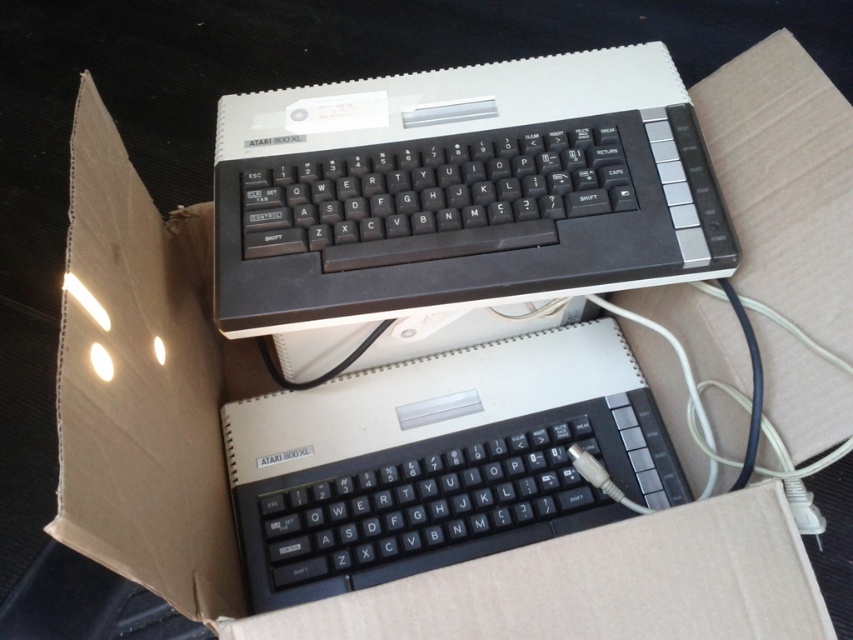
Who is positioned more to the right, black plastic keyboard at upper center or black plastic keyboard at center?

black plastic keyboard at upper center is more to the right.

Does point (573, 147) come behind point (439, 525)?

No, (573, 147) is in front of (439, 525).

Who is more distant from viewer, (399, 211) or (546, 380)?

Point (546, 380)

Find the location of a particular element. The image size is (853, 640). black plastic keyboard at upper center is located at coordinates (461, 189).